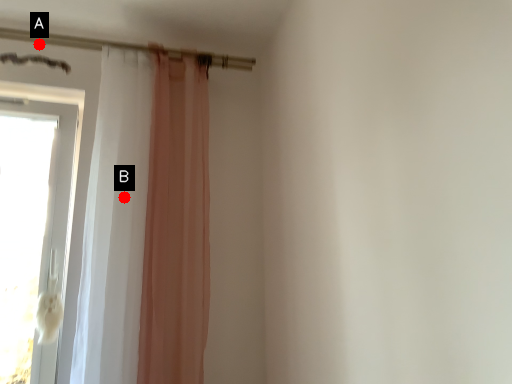
Question: Two points are circled on the image, labeled by A and B beside each circle. Which point is farther from the camera taking this photo?

Choices:
 (A) A is further
 (B) B is further

Answer: (A)